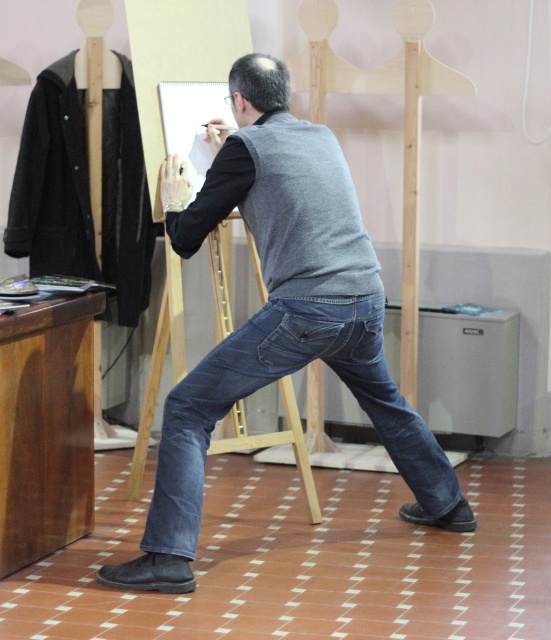
Question: Is gray matte vest at center in front of denim jeans at center?

Choices:
 (A) no
 (B) yes

Answer: (B)

Question: Does gray matte vest at center appear under denim jeans at center?

Choices:
 (A) yes
 (B) no

Answer: (B)

Question: Among these objects, which one is nearest to the camera?

Choices:
 (A) denim jeans at center
 (B) gray matte vest at center

Answer: (B)

Question: Is gray matte vest at center smaller than denim jeans at center?

Choices:
 (A) no
 (B) yes

Answer: (A)